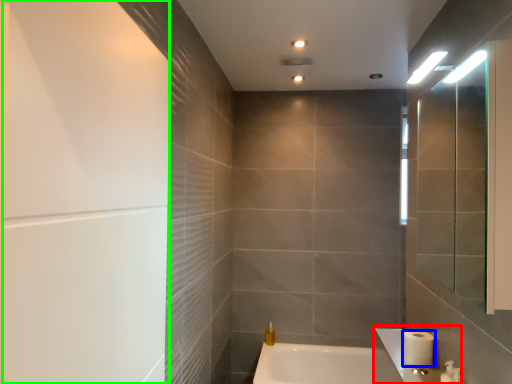
Question: Estimate the real-world distances between objects in this image. Which object is closer to sink (highlighted by a red box), toilet paper (highlighted by a blue box) or screen door (highlighted by a green box)?

Choices:
 (A) toilet paper
 (B) screen door

Answer: (A)